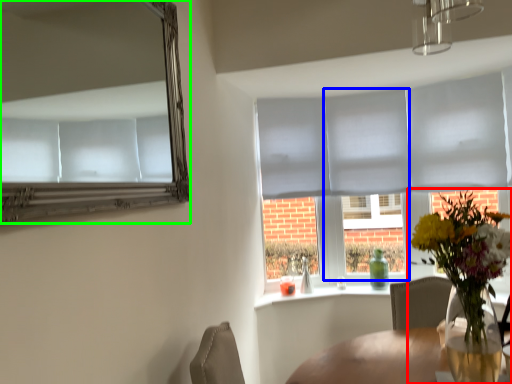
Question: Which is farther away from houseplant (highlighted by a red box)? glass door (highlighted by a blue box) or mirror (highlighted by a green box)?

Choices:
 (A) glass door
 (B) mirror

Answer: (A)